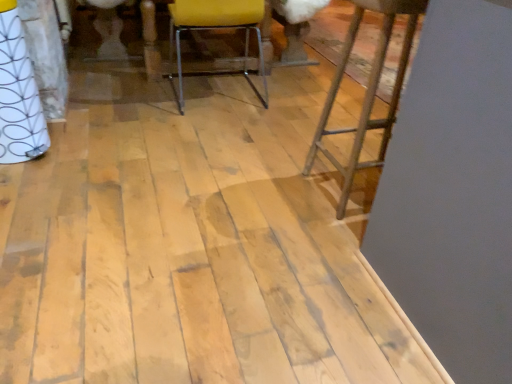
Image resolution: width=512 pixels, height=384 pixels. I want to click on free space to the left of rustic wood stool at right, so click(x=278, y=187).